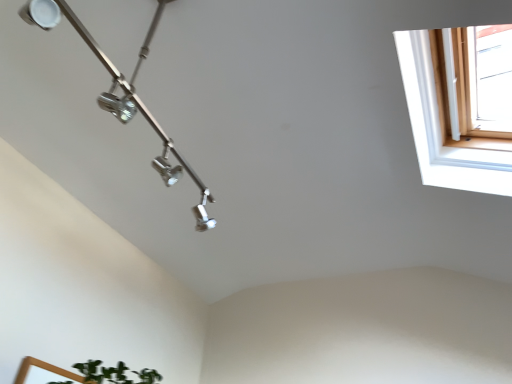
You are a GUI agent. You are given a task and a screenshot of the screen. Output one action in this format:
    pyautogui.click(x=<x>, y=<y>)
    Task: Click on the metallic track lighting at upper left
    
    Given the screenshot: What is the action you would take?
    pyautogui.click(x=124, y=92)

The height and width of the screenshot is (384, 512). What do you see at coordinates (124, 92) in the screenshot?
I see `metallic track lighting at upper left` at bounding box center [124, 92].

The width and height of the screenshot is (512, 384). What do you see at coordinates (439, 131) in the screenshot?
I see `white wooden window at upper right` at bounding box center [439, 131].

Where is `white wooden window at upper right`? white wooden window at upper right is located at coordinates (439, 131).

This screenshot has width=512, height=384. What are the coordinates of `metallic track lighting at upper left` in the screenshot? It's located at (124, 92).

Is metallic track lighting at upper left to the left of white wooden window at upper right from the viewer's perspective?

Yes.

Based on the photo, who is more distant, metallic track lighting at upper left or white wooden window at upper right?

white wooden window at upper right is further away from the camera.

Does point (143, 115) appear closer or farther from the camera than point (418, 158)?

Point (143, 115).

From the image's perspective, who appears lower, metallic track lighting at upper left or white wooden window at upper right?

metallic track lighting at upper left, from the image's perspective.

From a real-world perspective, is metallic track lighting at upper left located higher than white wooden window at upper right?

No.

Between metallic track lighting at upper left and white wooden window at upper right, which one has smaller width?

With smaller width is metallic track lighting at upper left.

Between metallic track lighting at upper left and white wooden window at upper right, which one has more height?

Standing taller between the two is metallic track lighting at upper left.

Between metallic track lighting at upper left and white wooden window at upper right, which one has smaller size?

Smaller between the two is metallic track lighting at upper left.

Can we say metallic track lighting at upper left lies outside white wooden window at upper right?

metallic track lighting at upper left is positioned outside white wooden window at upper right.

Are metallic track lighting at upper left and white wooden window at upper right located far from each other?

Actually, metallic track lighting at upper left and white wooden window at upper right are a little close together.

Is metallic track lighting at upper left aimed at white wooden window at upper right?

Yes, metallic track lighting at upper left is turned towards white wooden window at upper right.

The height and width of the screenshot is (384, 512). I want to click on lamp below the white wooden window at upper right (from the image's perspective), so click(x=124, y=92).

Looking at this image, between white wooden window at upper right and metallic track lighting at upper left, which one appears on the right side from the viewer's perspective?

white wooden window at upper right is more to the right.

Is white wooden window at upper right further to camera compared to metallic track lighting at upper left?

That is True.

Is point (462, 169) farther from viewer compared to point (197, 183)?

That is True.

From the image's perspective, which is above, white wooden window at upper right or metallic track lighting at upper left?

white wooden window at upper right appears higher in the image.

From a real-world perspective, does white wooden window at upper right stand above metallic track lighting at upper left?

Yes, from a real-world perspective, white wooden window at upper right is above metallic track lighting at upper left.

Can you confirm if white wooden window at upper right is wider than metallic track lighting at upper left?

Yes.

Does white wooden window at upper right have a greater height compared to metallic track lighting at upper left?

No.

Considering the relative sizes of white wooden window at upper right and metallic track lighting at upper left in the image provided, is white wooden window at upper right smaller than metallic track lighting at upper left?

No, white wooden window at upper right is not smaller than metallic track lighting at upper left.

Would you say white wooden window at upper right is outside metallic track lighting at upper left?

Yes, white wooden window at upper right is located beyond the bounds of metallic track lighting at upper left.

Is white wooden window at upper right far from metallic track lighting at upper left?

No, white wooden window at upper right is not far away from metallic track lighting at upper left.

Is white wooden window at upper right looking in the opposite direction of metallic track lighting at upper left?

That's not correct — white wooden window at upper right is not looking away from metallic track lighting at upper left.

Measure the distance between white wooden window at upper right and metallic track lighting at upper left.

white wooden window at upper right is 36.20 inches away from metallic track lighting at upper left.

Identify the location of lamp located in front of the white wooden window at upper right. (124, 92).

At what (x,y) coordinates should I click in order to perform the action: click on window above the metallic track lighting at upper left (from a real-world perspective). Please return your answer as a coordinate pair (x, y). The image size is (512, 384). Looking at the image, I should click on (439, 131).

The height and width of the screenshot is (384, 512). In order to click on window above the metallic track lighting at upper left (from the image's perspective) in this screenshot , I will do `click(439, 131)`.